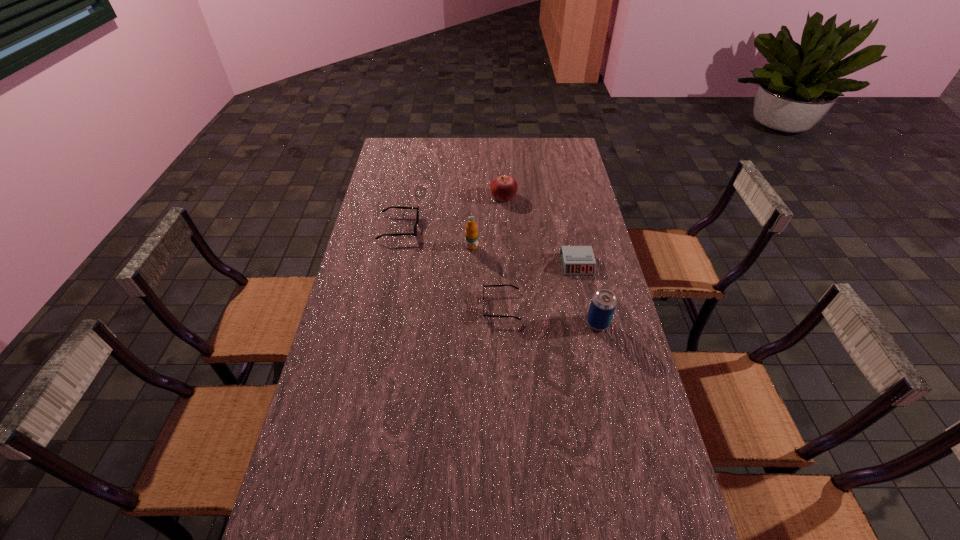
Where is `free point between the beer can and the apple`? The height and width of the screenshot is (540, 960). free point between the beer can and the apple is located at coordinates (551, 260).

Where is `unoccupied area between the beer can and the second object from left to right`? The width and height of the screenshot is (960, 540). unoccupied area between the beer can and the second object from left to right is located at coordinates (535, 285).

Find the location of a particular element. free space between the leftmost object and the beer can is located at coordinates (498, 275).

The height and width of the screenshot is (540, 960). Identify the location of vacant point located between the farthest object and the alarm clock. (540, 231).

Image resolution: width=960 pixels, height=540 pixels. In order to click on object that stands as the second closest to the fourth shortest object in this screenshot , I will do `click(414, 233)`.

The image size is (960, 540). I want to click on the fifth closest object to the farther sunglasses, so click(x=603, y=303).

The image size is (960, 540). I want to click on vacant space that satisfies the following two spatial constraints: 1. on the label of the second object from left to right; 2. on the left side of the beer can, so click(470, 323).

Image resolution: width=960 pixels, height=540 pixels. In order to click on free space that satisfies the following two spatial constraints: 1. on the front-facing side of the right sunglasses; 2. on the right side of the beer can in this screenshot , I will do `click(502, 323)`.

Identify the location of vacant region that satisfies the following two spatial constraints: 1. on the front side of the apple; 2. on the front-facing side of the shorter sunglasses. Image resolution: width=960 pixels, height=540 pixels. (510, 306).

I want to click on free point that satisfies the following two spatial constraints: 1. on the label of the alarm clock; 2. on the right side of the orange juice, so click(x=471, y=264).